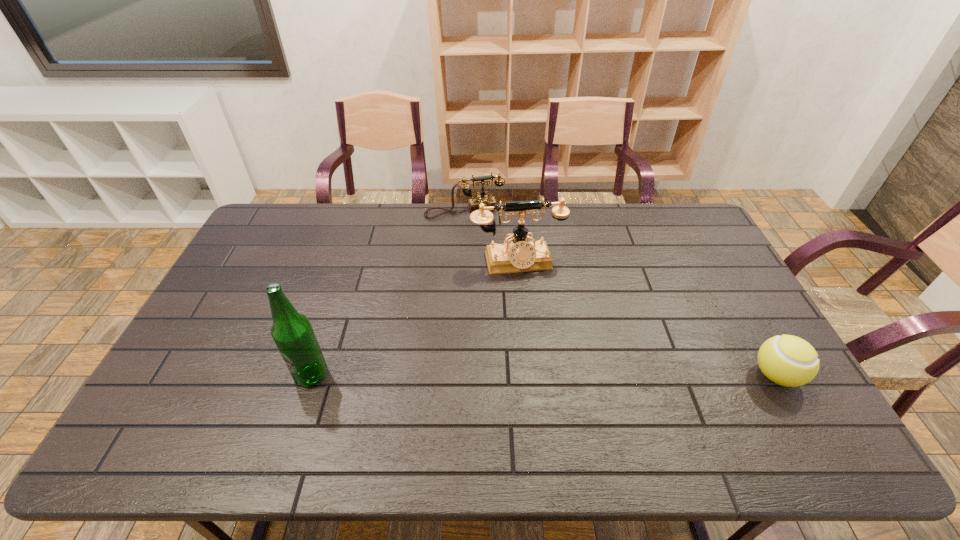
Identify the location of free space at the far edge of the desktop. This screenshot has width=960, height=540. (387, 242).

Locate an element on the screen. The height and width of the screenshot is (540, 960). vacant space at the near edge of the desktop is located at coordinates (665, 398).

Where is `vacant region at the left edge of the desktop`? Image resolution: width=960 pixels, height=540 pixels. vacant region at the left edge of the desktop is located at coordinates (224, 284).

In order to click on vacant space at the right edge of the desktop in this screenshot , I will do `click(733, 280)`.

In order to click on free space at the near left corner in this screenshot , I will do `click(181, 404)`.

In the image, there is a desktop. Where is `vacant region at the far right corner`? vacant region at the far right corner is located at coordinates (686, 225).

Where is `empty space between the tallest object and the rightmost object`? empty space between the tallest object and the rightmost object is located at coordinates tap(543, 375).

Locate an element on the screen. This screenshot has width=960, height=540. free space between the taller telephone and the tallest object is located at coordinates (414, 318).

Locate an element on the screen. This screenshot has height=540, width=960. vacant space that's between the rightmost object and the farthest object is located at coordinates 620,293.

Where is `vacant space that's between the shorter telephone and the tennis ball`? Image resolution: width=960 pixels, height=540 pixels. vacant space that's between the shorter telephone and the tennis ball is located at coordinates (620, 293).